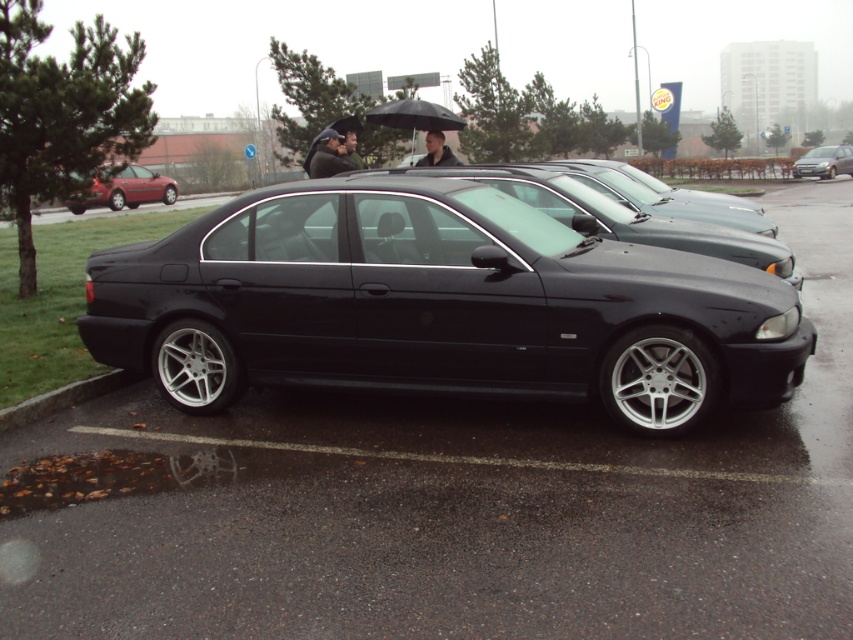
Is shiny black sedan at center smaller than black glossy sedan at center?

No.

Is shiny black sedan at center in front of black glossy sedan at center?

Yes, shiny black sedan at center is closer to the viewer.

Is point (676, 376) closer to camera compared to point (619, 188)?

Yes, it is.

Find the location of a particular element. The height and width of the screenshot is (640, 853). shiny black sedan at center is located at coordinates (438, 305).

Does metallic red sedan at left have a lesser height compared to black matte umbrella at upper center?

No, metallic red sedan at left is not shorter than black matte umbrella at upper center.

Between point (135, 186) and point (403, 125), which one is positioned in front?

Positioned in front is point (403, 125).

Is point (170, 196) closer to camera compared to point (422, 124)?

That is False.

Locate an element on the screen. metallic red sedan at left is located at coordinates (125, 189).

Is black metallic car at center to the right of smooth black hair at center from the viewer's perspective?

Correct, you'll find black metallic car at center to the right of smooth black hair at center.

Is black metallic car at center taller than smooth black hair at center?

Yes, black metallic car at center is taller than smooth black hair at center.

Does point (645, 236) come in front of point (425, 156)?

Yes, point (645, 236) is in front of point (425, 156).

Identify the location of black metallic car at center. The image size is (853, 640). (625, 218).